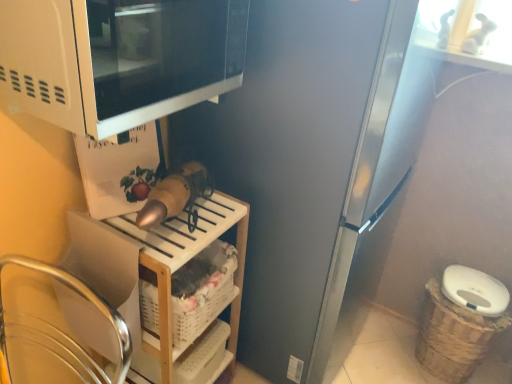
Find the location of a particular element. The image size is (512, 384). free space above white plastic shelf at lower center (from a real-world perspective) is located at coordinates (181, 212).